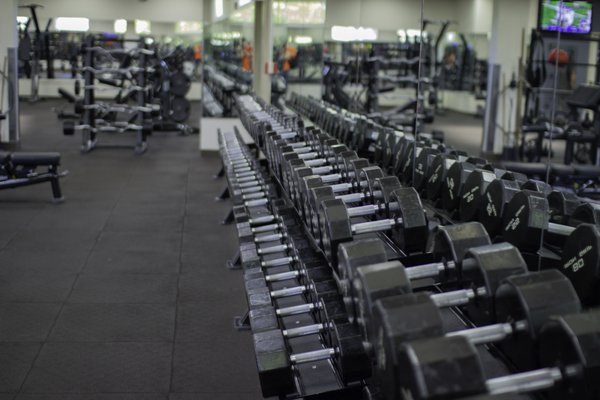
The image size is (600, 400). Find the location of `mirror panes`. mirror panes is located at coordinates (569, 132), (477, 108), (381, 89), (329, 76), (280, 60).